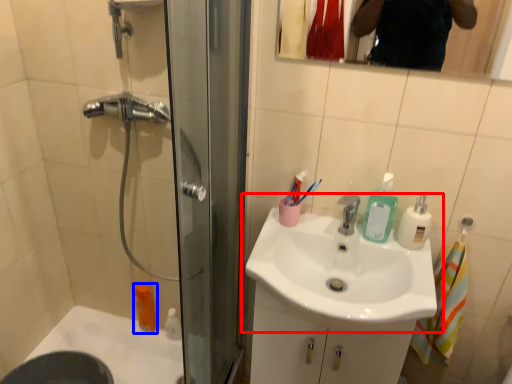
Question: Which point is closer to the camera, sink (highlighted by a red box) or mouthwash (highlighted by a blue box)?

Choices:
 (A) sink
 (B) mouthwash

Answer: (A)